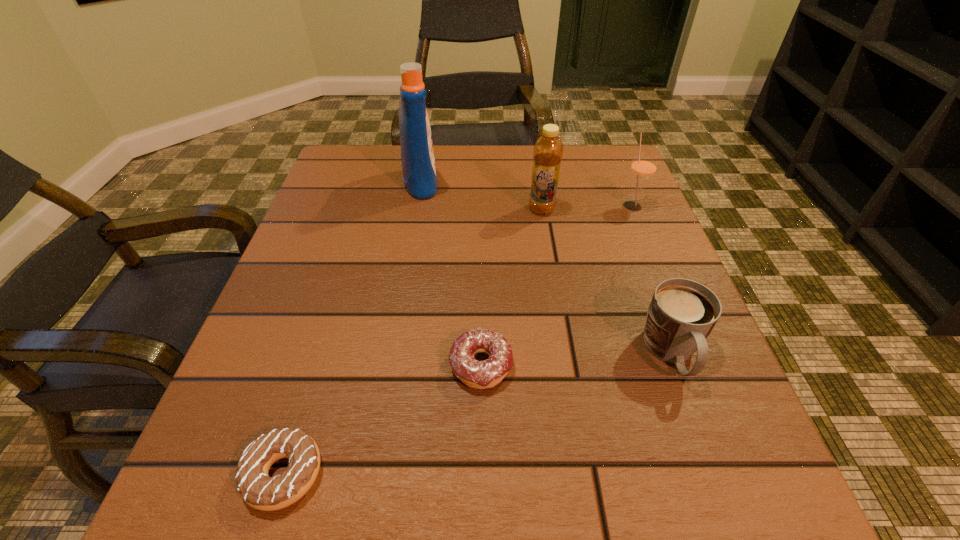
Where is `straw located at the right edge`? straw located at the right edge is located at coordinates (643, 167).

At what (x,y) coordinates should I click in order to perform the action: click on mug that is at the right edge. Please return your answer as a coordinate pair (x, y). Looking at the image, I should click on (682, 313).

This screenshot has width=960, height=540. Identify the location of object positioned at the near left corner. (257, 489).

Where is `object that is at the far right corner`? This screenshot has height=540, width=960. object that is at the far right corner is located at coordinates (643, 167).

This screenshot has width=960, height=540. In the image, there is a desktop. Identify the location of vacant space at the far edge. (504, 177).

This screenshot has height=540, width=960. In the image, there is a desktop. Identify the location of vacant space at the near edge. (372, 513).

Identify the location of free space at the left edge of the desktop. (259, 320).

In the image, there is a desktop. Where is `free space at the far left corner`? The width and height of the screenshot is (960, 540). free space at the far left corner is located at coordinates (363, 146).

Image resolution: width=960 pixels, height=540 pixels. What are the coordinates of `free space at the near left corner` in the screenshot? It's located at (213, 493).

Find the location of `free space at the far right corner of the desktop`. free space at the far right corner of the desktop is located at coordinates (587, 198).